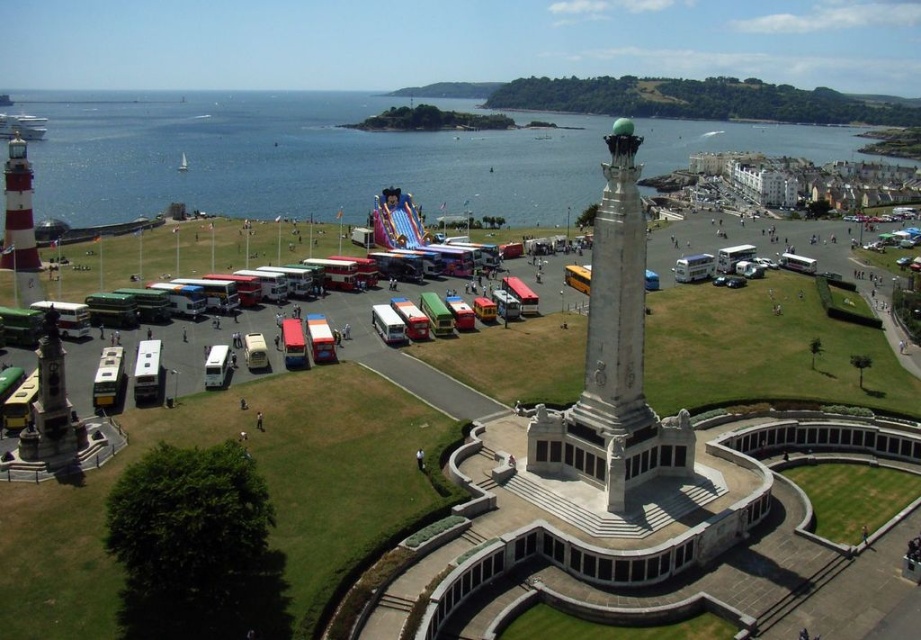
You are standing at the base of the white marble monument at center and want to walk to the polished stone monument at lower left. Which direction should you face to walk downhill?

You should face downward because the white marble monument at center is located above the polished stone monument at lower left, so walking downhill towards it would require facing downward.

You are standing at the center of the image and want to locate the polished stone monument at lower left. According to the coordinates provided, in which direction should you look to find it?

The polished stone monument at lower left is located at coordinates point (51, 410), which means you should look to the lower left direction to find it.

You are a tourist standing at the base of the white marble monument at center and want to take a photo of both it and the polished stone monument at lower left. Which monument should you position closer to the camera to ensure both are in frame?

The white marble monument at center is taller than the polished stone monument at lower left, so you should position the camera closer to the polished stone monument at lower left to ensure both monuments are in frame.